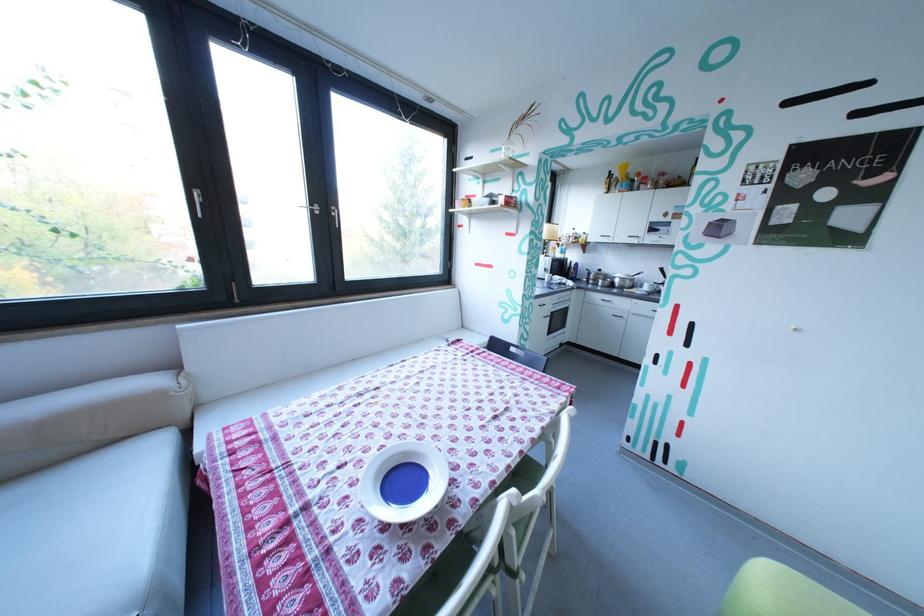
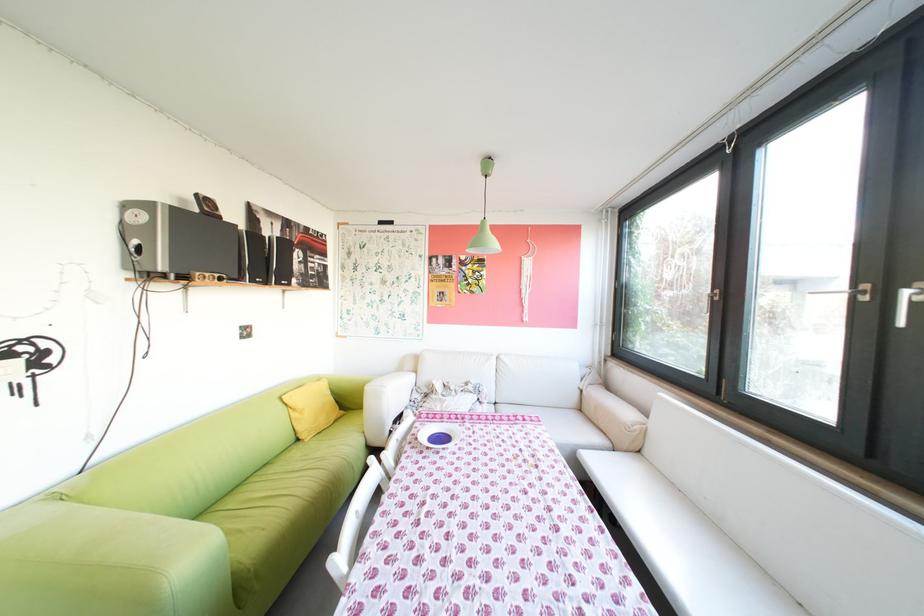
Question: I am providing you with two images of the same scene from different viewpoints. Which of the following objects are not visible in image2?

Choices:
 (A) green sofa surface
 (B) silver window handle
 (C) orange-cover book
 (D) chair sitting surface

Answer: (D)